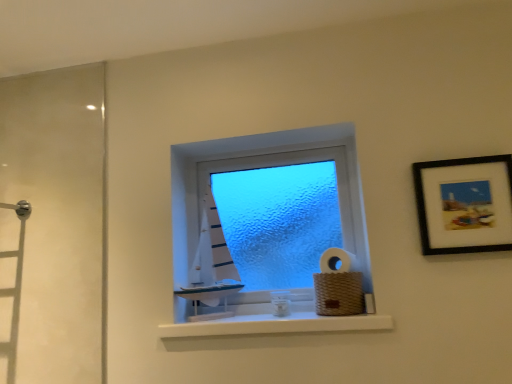
Question: From a real-world perspective, is white matte sailboat at center physically below white matte window sill at center?

Choices:
 (A) yes
 (B) no

Answer: (B)

Question: Is white matte sailboat at center far away from white matte window sill at center?

Choices:
 (A) yes
 (B) no

Answer: (B)

Question: Is white matte sailboat at center bigger than white matte window sill at center?

Choices:
 (A) yes
 (B) no

Answer: (A)

Question: Considering the relative positions of white matte sailboat at center and white matte window sill at center in the image provided, is white matte sailboat at center to the left of white matte window sill at center from the viewer's perspective?

Choices:
 (A) no
 (B) yes

Answer: (B)

Question: Does white matte sailboat at center have a lesser height compared to white matte window sill at center?

Choices:
 (A) yes
 (B) no

Answer: (B)

Question: Considering the relative positions of black matte picture frame at upper right and white matte toilet paper at center, which is the second toilet paper in bottom-to-top order, in the image provided, is black matte picture frame at upper right to the left or to the right of white matte toilet paper at center, which is the second toilet paper in bottom-to-top order,?

Choices:
 (A) right
 (B) left

Answer: (A)

Question: Based on their sizes in the image, would you say black matte picture frame at upper right is bigger or smaller than white matte toilet paper at center, which is the second toilet paper in bottom-to-top order?

Choices:
 (A) big
 (B) small

Answer: (A)

Question: Considering the positions of black matte picture frame at upper right and white matte toilet paper at center, which ranks as the 1th toilet paper in top-to-bottom order, in the image, is black matte picture frame at upper right wider or thinner than white matte toilet paper at center, which ranks as the 1th toilet paper in top-to-bottom order,?

Choices:
 (A) wide
 (B) thin

Answer: (B)

Question: In the image, is black matte picture frame at upper right positioned in front of or behind white matte toilet paper at center, which is the second toilet paper in bottom-to-top order?

Choices:
 (A) front
 (B) behind

Answer: (A)

Question: Considering the positions of woven brown basket at lower right, positioned as the first toilet paper in bottom-to-top order, and white matte toilet paper at center, which ranks as the 1th toilet paper in top-to-bottom order, in the image, is woven brown basket at lower right, positioned as the first toilet paper in bottom-to-top order, wider or thinner than white matte toilet paper at center, which ranks as the 1th toilet paper in top-to-bottom order,?

Choices:
 (A) thin
 (B) wide

Answer: (B)

Question: Considering the positions of point (344, 274) and point (348, 256), is point (344, 274) closer or farther from the camera than point (348, 256)?

Choices:
 (A) farther
 (B) closer

Answer: (B)

Question: In the image, is woven brown basket at lower right, which ranks as the 2th toilet paper in top-to-bottom order, on the left side or the right side of white matte toilet paper at center, which is the second toilet paper in bottom-to-top order?

Choices:
 (A) right
 (B) left

Answer: (B)

Question: Based on their sizes in the image, would you say woven brown basket at lower right, which ranks as the 2th toilet paper in top-to-bottom order, is bigger or smaller than white matte toilet paper at center, which ranks as the 1th toilet paper in top-to-bottom order?

Choices:
 (A) big
 (B) small

Answer: (A)

Question: Is white matte window sill at center bigger or smaller than woven brown basket at lower right, which ranks as the 2th toilet paper in top-to-bottom order?

Choices:
 (A) big
 (B) small

Answer: (A)

Question: Which is correct: white matte window sill at center is inside woven brown basket at lower right, positioned as the first toilet paper in bottom-to-top order, or outside of it?

Choices:
 (A) outside
 (B) inside

Answer: (A)